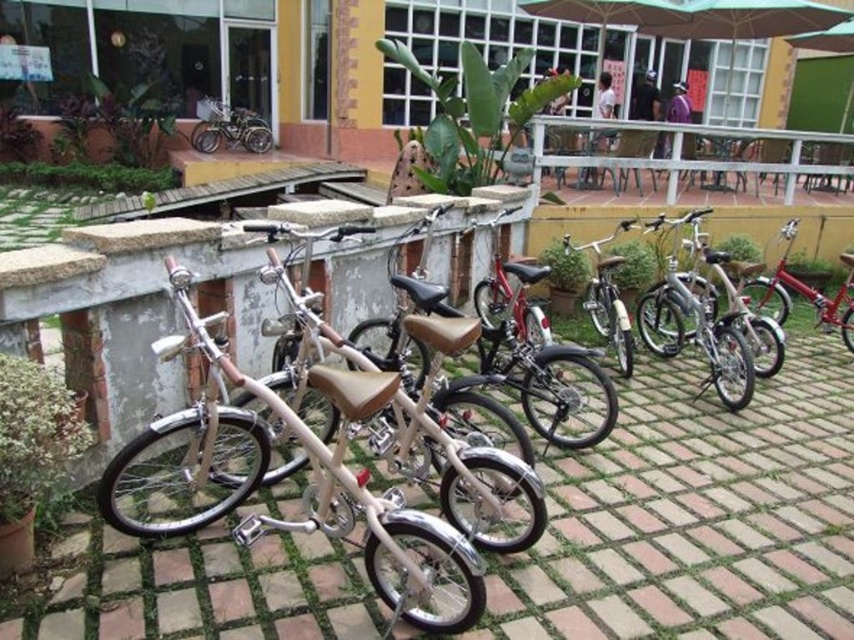
You are standing in front of a row of bicycles parked along a wall. You want to know if you can comfortably walk around the matte beige bicycle at center without stepping onto the concrete wall behind it. The path between you and the bicycle is clear. Can you do this?

The matte beige bicycle at center is 6.22 feet away from you, providing sufficient space to walk around it without needing to step onto the concrete wall behind it.

Based on the photo, you are a delivery person who needs to retrieve your bicycle parked along the wall. You see the shiny silver bicycle at center and the silver metallic bicycle at upper left. Which bicycle is closer to you?

Answer: The shiny silver bicycle at center is closer to you because it is in front of the silver metallic bicycle at upper left.